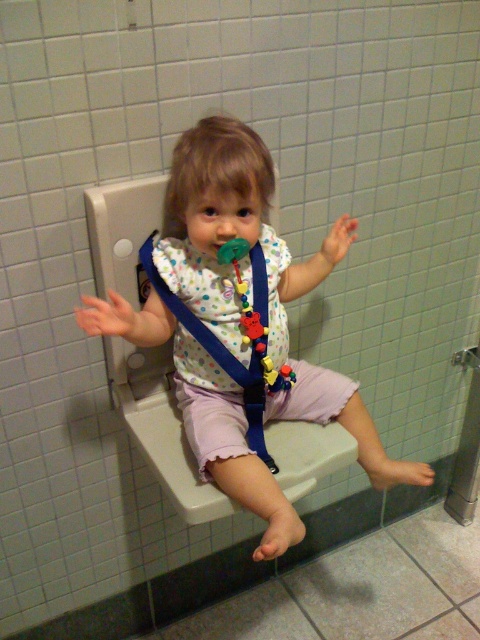
Question: Can you confirm if pastel polka dot shirt at center is positioned below white dotted fabric bib at center?

Choices:
 (A) yes
 (B) no

Answer: (A)

Question: Which point is closer to the camera?

Choices:
 (A) (260, 515)
 (B) (248, 324)

Answer: (A)

Question: Which point is farther to the camera?

Choices:
 (A) (386, 465)
 (B) (259, 371)

Answer: (A)

Question: Is pastel polka dot shirt at center behind white dotted fabric bib at center?

Choices:
 (A) yes
 (B) no

Answer: (B)

Question: Does pastel polka dot shirt at center come in front of white dotted fabric bib at center?

Choices:
 (A) yes
 (B) no

Answer: (A)